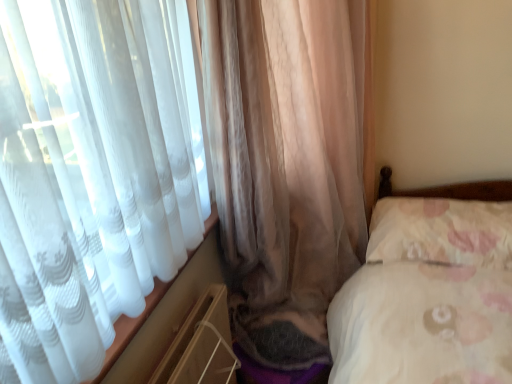
Question: From the image's perspective, is translucent fabric curtain at left, marked as the 1th curtain in a right-to-left arrangement, on fluffy white pillow at right?

Choices:
 (A) no
 (B) yes

Answer: (A)

Question: Could you tell me if translucent fabric curtain at left, which is counted as the 2th curtain, starting from the left, is turned towards fluffy white pillow at right?

Choices:
 (A) yes
 (B) no

Answer: (A)

Question: Is translucent fabric curtain at left, marked as the 1th curtain in a right-to-left arrangement, to the right of fluffy white pillow at right from the viewer's perspective?

Choices:
 (A) no
 (B) yes

Answer: (A)

Question: Considering the relative positions of translucent fabric curtain at left, which is counted as the 2th curtain, starting from the left, and fluffy white pillow at right in the image provided, is translucent fabric curtain at left, which is counted as the 2th curtain, starting from the left, in front of fluffy white pillow at right?

Choices:
 (A) yes
 (B) no

Answer: (A)

Question: From a real-world perspective, is translucent fabric curtain at left, marked as the 1th curtain in a right-to-left arrangement, under fluffy white pillow at right?

Choices:
 (A) no
 (B) yes

Answer: (A)

Question: In the image, is translucent fabric curtain at left, which is counted as the 2th curtain, starting from the left, positioned in front of or behind translucent beige curtain at left, the 1th curtain in the left-to-right sequence?

Choices:
 (A) behind
 (B) front

Answer: (B)

Question: Is translucent fabric curtain at left, marked as the 1th curtain in a right-to-left arrangement, to the left or to the right of translucent beige curtain at left, the 1th curtain in the left-to-right sequence, in the image?

Choices:
 (A) right
 (B) left

Answer: (A)

Question: From their relative heights in the image, would you say translucent fabric curtain at left, which is counted as the 2th curtain, starting from the left, is taller or shorter than translucent beige curtain at left, positioned as the 2th curtain in right-to-left order?

Choices:
 (A) tall
 (B) short

Answer: (B)

Question: Is point (80, 380) positioned closer to the camera than point (316, 221)?

Choices:
 (A) closer
 (B) farther

Answer: (A)

Question: In the image, is translucent beige curtain at left, positioned as the 2th curtain in right-to-left order, on the left side or the right side of fluffy white pillow at right?

Choices:
 (A) left
 (B) right

Answer: (A)

Question: From the image's perspective, is translucent beige curtain at left, the 1th curtain in the left-to-right sequence, above or below fluffy white pillow at right?

Choices:
 (A) above
 (B) below

Answer: (A)

Question: Based on their sizes in the image, would you say translucent beige curtain at left, positioned as the 2th curtain in right-to-left order, is bigger or smaller than fluffy white pillow at right?

Choices:
 (A) big
 (B) small

Answer: (A)

Question: Is translucent beige curtain at left, the 1th curtain in the left-to-right sequence, situated inside fluffy white pillow at right or outside?

Choices:
 (A) outside
 (B) inside

Answer: (A)

Question: Is point (45, 135) positioned closer to the camera than point (489, 215)?

Choices:
 (A) closer
 (B) farther

Answer: (A)

Question: Is translucent fabric curtain at left, marked as the 1th curtain in a right-to-left arrangement, in front of or behind fluffy white pillow at right in the image?

Choices:
 (A) front
 (B) behind

Answer: (A)